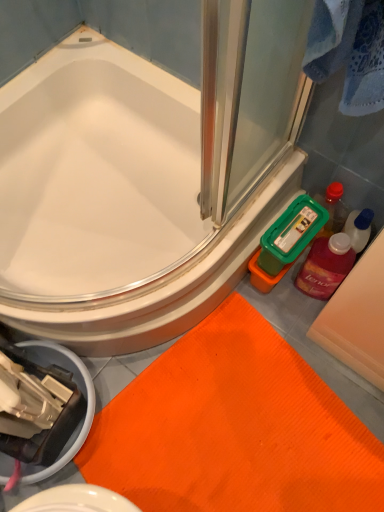
Question: In the image, is white glossy bathtub at upper left positioned in front of or behind orange textured bath mat at lower center?

Choices:
 (A) behind
 (B) front

Answer: (B)

Question: From a real-world perspective, is white glossy bathtub at upper left physically located above or below orange textured bath mat at lower center?

Choices:
 (A) below
 (B) above

Answer: (B)

Question: Which object is the closest to the orange textured bath mat at lower center?

Choices:
 (A) translucent plastic mouthwash at right
 (B) white glossy bathtub at upper left

Answer: (A)

Question: Estimate the real-world distances between objects in this image. Which object is closer to the orange textured bath mat at lower center?

Choices:
 (A) translucent plastic mouthwash at right
 (B) white glossy bathtub at upper left

Answer: (A)